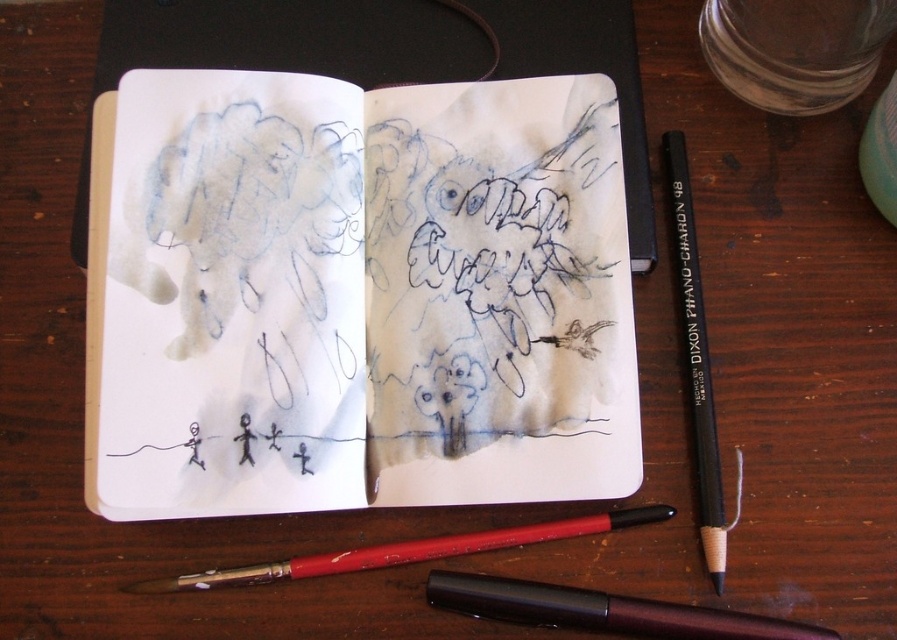
Is red wood pencil at lower center to the right of black pencil at right from the viewer's perspective?

In fact, red wood pencil at lower center is to the left of black pencil at right.

Where is `red wood pencil at lower center`? red wood pencil at lower center is located at coordinates pos(406,552).

Between point (373, 556) and point (703, 340), which one is positioned in front?

Positioned in front is point (373, 556).

Where is `red wood pencil at lower center`? red wood pencil at lower center is located at coordinates (406, 552).

Is point (471, 604) closer to camera compared to point (692, 227)?

Yes, it is in front of point (692, 227).

What do you see at coordinates (602, 611) in the screenshot?
I see `metallic burgundy pen at lower center` at bounding box center [602, 611].

Locate an element on the screen. The width and height of the screenshot is (897, 640). metallic burgundy pen at lower center is located at coordinates (602, 611).

This screenshot has height=640, width=897. Describe the element at coordinates (358, 296) in the screenshot. I see `blue ink sketchbook at center` at that location.

Is point (417, 304) closer to camera compared to point (528, 621)?

No, it is not.

Where is `blue ink sketchbook at center`? The width and height of the screenshot is (897, 640). blue ink sketchbook at center is located at coordinates (358, 296).